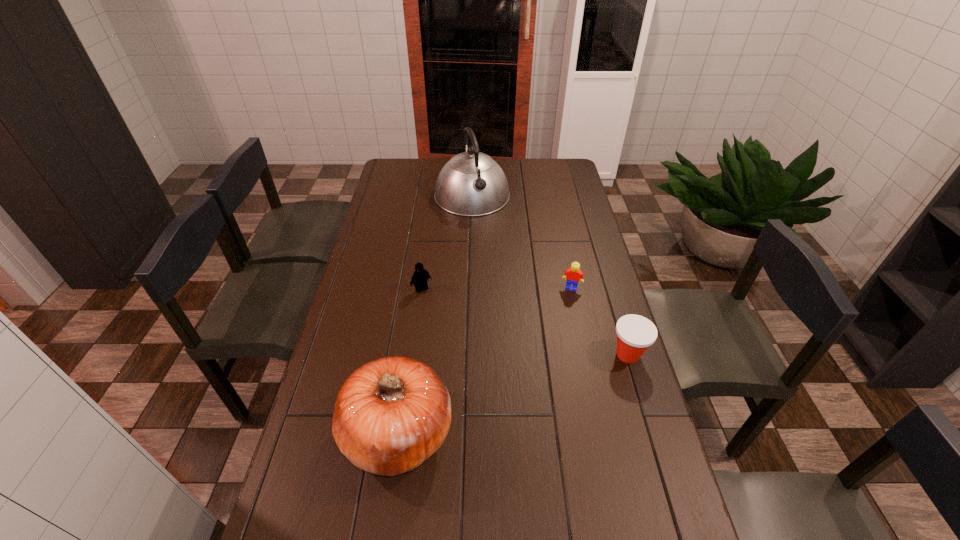
Identify the location of vacant point located 0.330m on the face of the left Lego. Image resolution: width=960 pixels, height=540 pixels. (470, 360).

What are the coordinates of `vacant region located 0.060m on the face of the left Lego` in the screenshot? It's located at (434, 304).

Find the location of a particular element. This screenshot has width=960, height=540. free space located 0.130m on the face of the left Lego is located at coordinates (443, 317).

Where is `free space located 0.180m on the front-facing side of the right Lego`? This screenshot has height=540, width=960. free space located 0.180m on the front-facing side of the right Lego is located at coordinates (562, 328).

Where is `vacant space situated 0.160m on the front-facing side of the right Lego`? This screenshot has height=540, width=960. vacant space situated 0.160m on the front-facing side of the right Lego is located at coordinates (563, 324).

Find the location of a particular element. free space located 0.310m on the front-facing side of the right Lego is located at coordinates tap(555, 360).

Find the location of `vacant area situated from the spout of the tallest object`. vacant area situated from the spout of the tallest object is located at coordinates (503, 272).

Identify the location of vacant space positioned 0.250m from the spout of the tallest object. This screenshot has width=960, height=540. (x=496, y=254).

The width and height of the screenshot is (960, 540). In order to click on free space located from the spout of the tallest object in this screenshot , I will do point(491,241).

Locate an element on the screen. Image resolution: width=960 pixels, height=540 pixels. object situated at the far edge is located at coordinates (470, 184).